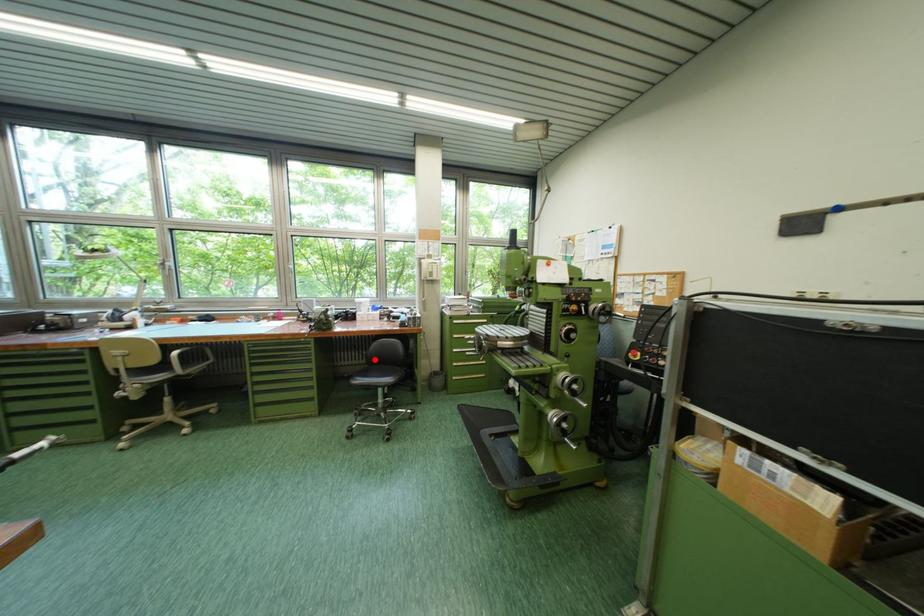
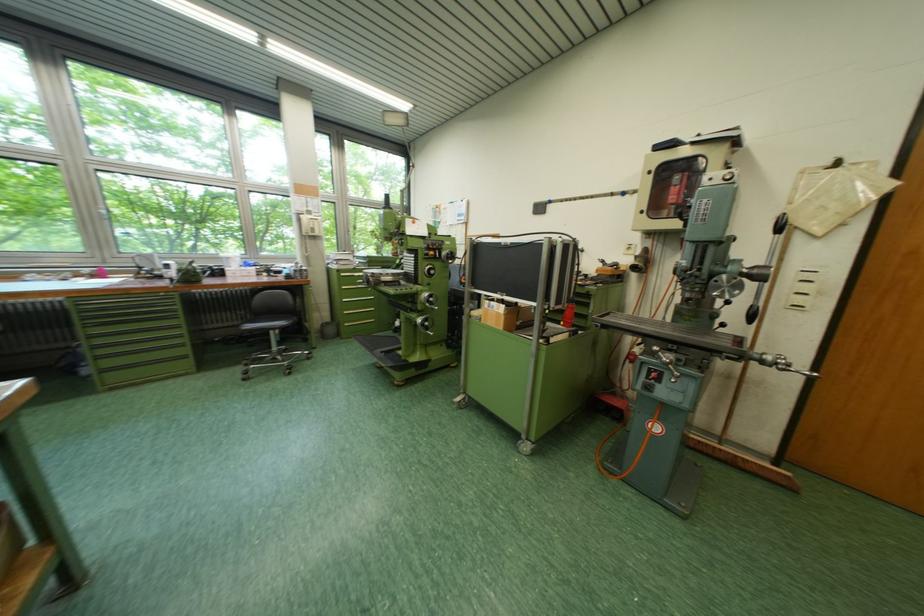
Find the pixel in the second image that matches the highlighted location in the first image.

(249, 320)